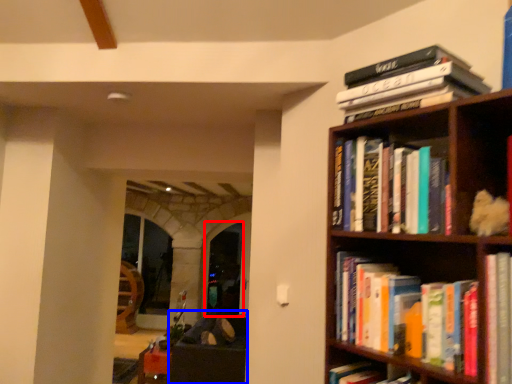
Question: Which point is further to the camera, glass door (highlighted by a red box) or furniture (highlighted by a blue box)?

Choices:
 (A) glass door
 (B) furniture

Answer: (A)